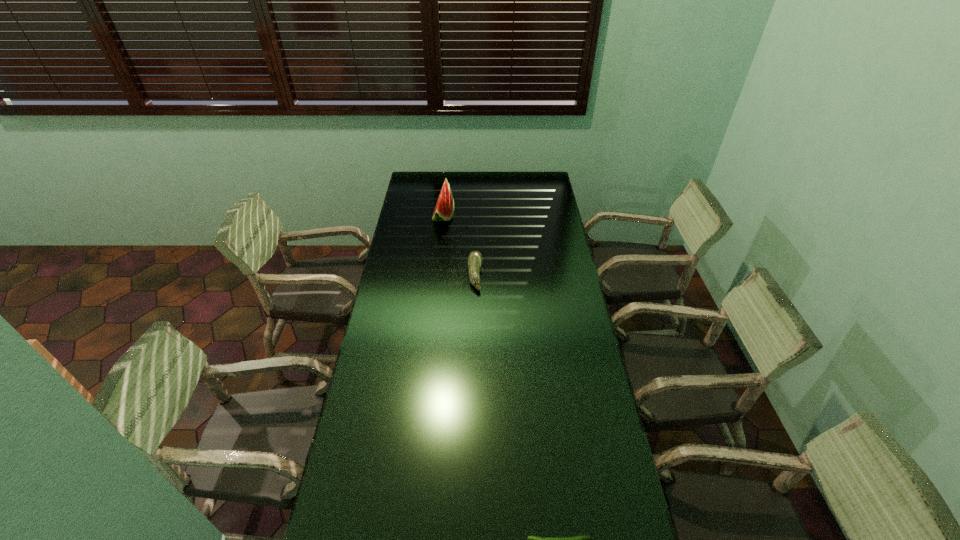
At what (x,y) coordinates should I click in order to perform the action: click on the tallest object. Please return your answer as a coordinate pair (x, y). Image resolution: width=960 pixels, height=540 pixels. Looking at the image, I should click on (444, 210).

The image size is (960, 540). I want to click on the farthest object, so click(x=444, y=210).

The height and width of the screenshot is (540, 960). Find the location of `the second object from right to left`. the second object from right to left is located at coordinates click(475, 258).

At what (x,y) coordinates should I click in order to perform the action: click on the second shortest object. Please return your answer as a coordinate pair (x, y). This screenshot has width=960, height=540. Looking at the image, I should click on (475, 258).

In order to click on free location located on the outer rind of the farthest object in this screenshot , I will do `click(513, 217)`.

Locate an element on the screen. vacant space situated at the stem end of the second shortest object is located at coordinates (569, 275).

In order to click on free space at the far edge in this screenshot , I will do `click(515, 187)`.

Where is `free space at the left edge of the desktop`? The image size is (960, 540). free space at the left edge of the desktop is located at coordinates (393, 245).

Identify the location of vacant space at the right edge of the desktop. (605, 482).

The height and width of the screenshot is (540, 960). In the image, there is a desktop. What are the coordinates of `vacant space at the far left corner` in the screenshot? It's located at (422, 186).